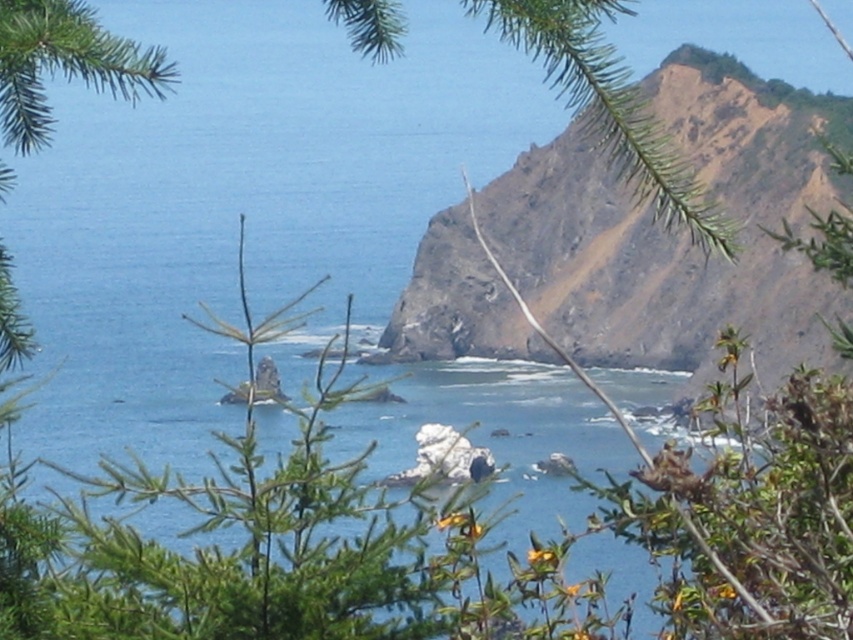
Can you confirm if rusty rock cliff at upper right is smaller than white rock at center?

No.

Which of these two, rusty rock cliff at upper right or white rock at center, stands shorter?

white rock at center

You are a GUI agent. You are given a task and a screenshot of the screen. Output one action in this format:
    pyautogui.click(x=<x>, y=<y>)
    Task: Click on the rusty rock cliff at upper right
    The width and height of the screenshot is (853, 640).
    Given the screenshot: What is the action you would take?
    pyautogui.click(x=676, y=232)

Between point (53, 580) and point (486, 461), which one is positioned in front?

Point (53, 580) is more forward.

Based on the photo, does green leafy tree at center come behind white rock at center?

No, green leafy tree at center is closer to the viewer.

Which is in front, point (242, 484) or point (419, 449)?

Positioned in front is point (242, 484).

Where is `green leafy tree at center`? The image size is (853, 640). green leafy tree at center is located at coordinates (257, 540).

Can you confirm if rusty rock cliff at upper right is positioned to the left of green leafy tree at center?

In fact, rusty rock cliff at upper right is to the right of green leafy tree at center.

Measure the distance from rusty rock cliff at upper right to green leafy tree at center.

rusty rock cliff at upper right is 14.19 meters from green leafy tree at center.

Is point (740, 166) in front of point (375, 540)?

No, (740, 166) is behind (375, 540).

Identify the location of rusty rock cliff at upper right. The height and width of the screenshot is (640, 853). (676, 232).